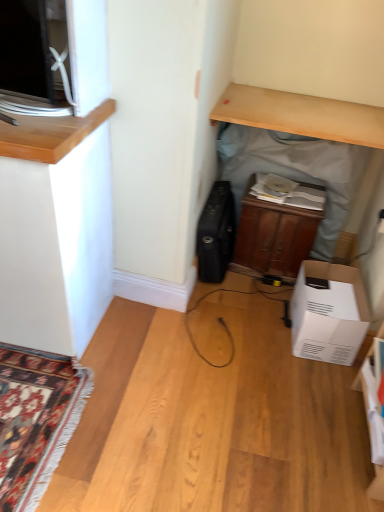
This screenshot has width=384, height=512. I want to click on vacant position to the left of white cardboard box at lower right, so click(x=261, y=326).